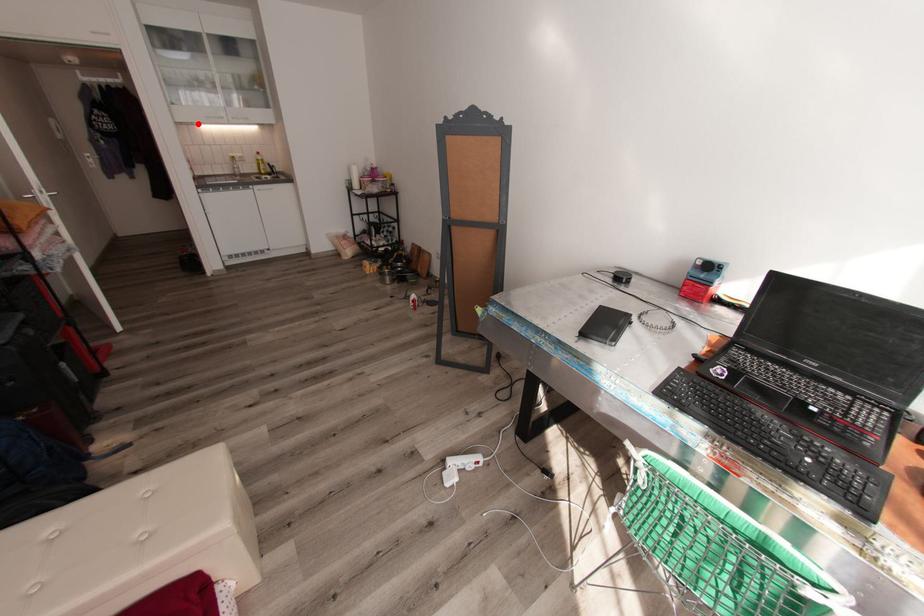
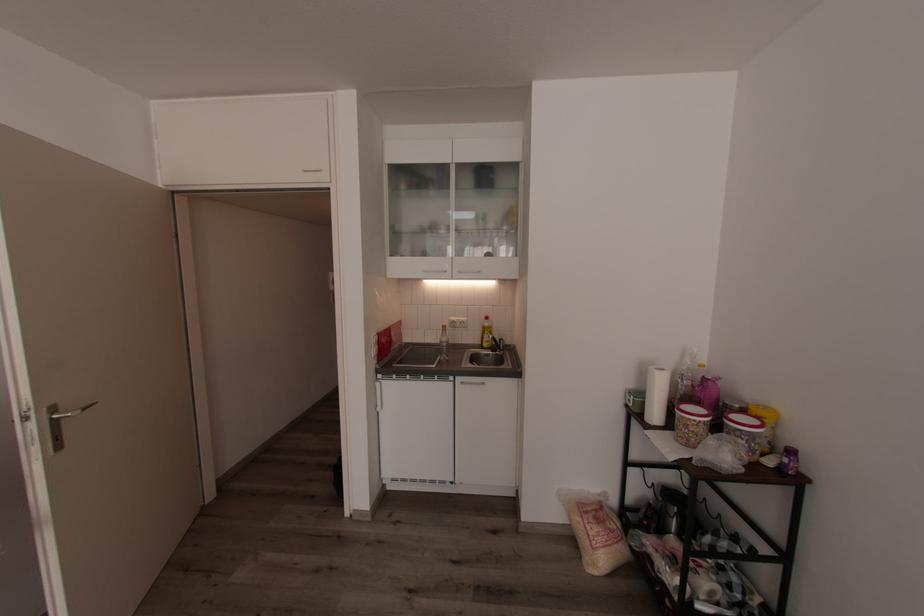
Find the pixel in the second image that matches the highlighted location in the first image.

(423, 280)